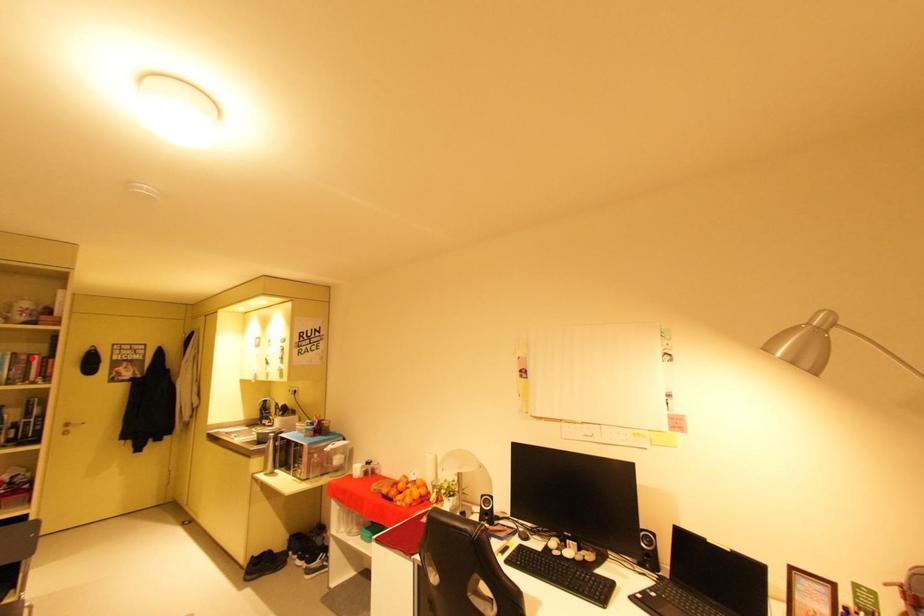
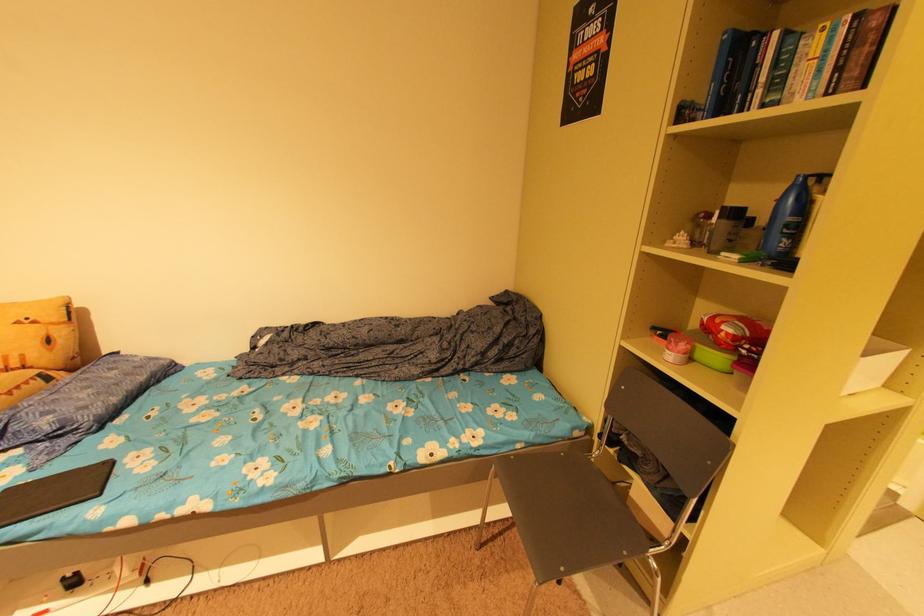
Locate, in the second image, the point that corresponds to the highlighted location in the first image.

(882, 22)